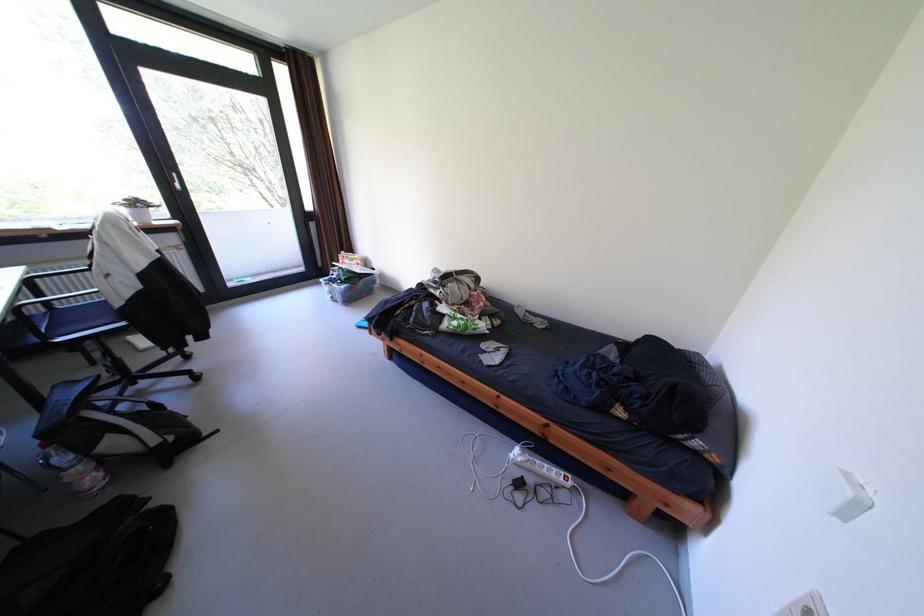
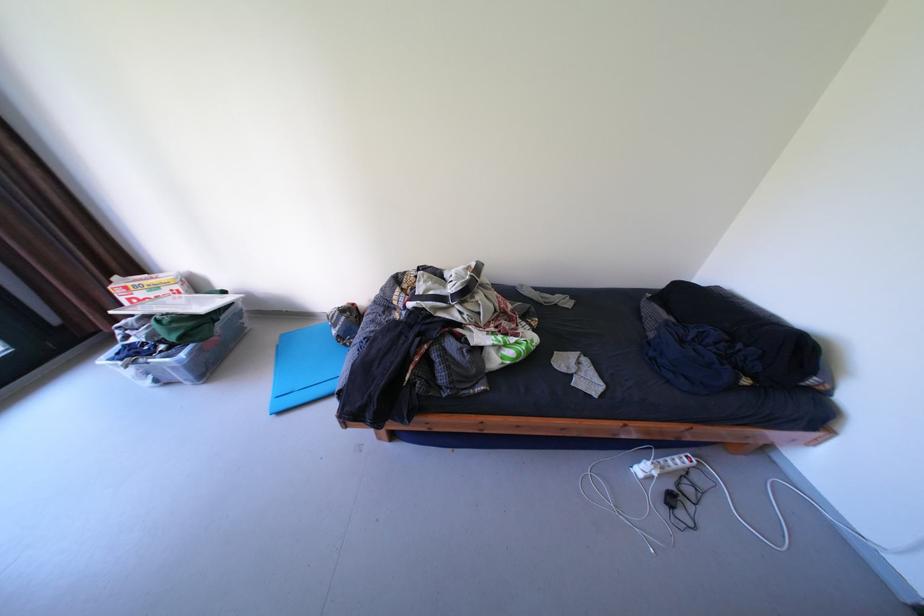
The point at (370, 262) is marked in the first image. Where is the corresponding point in the second image?

(188, 286)